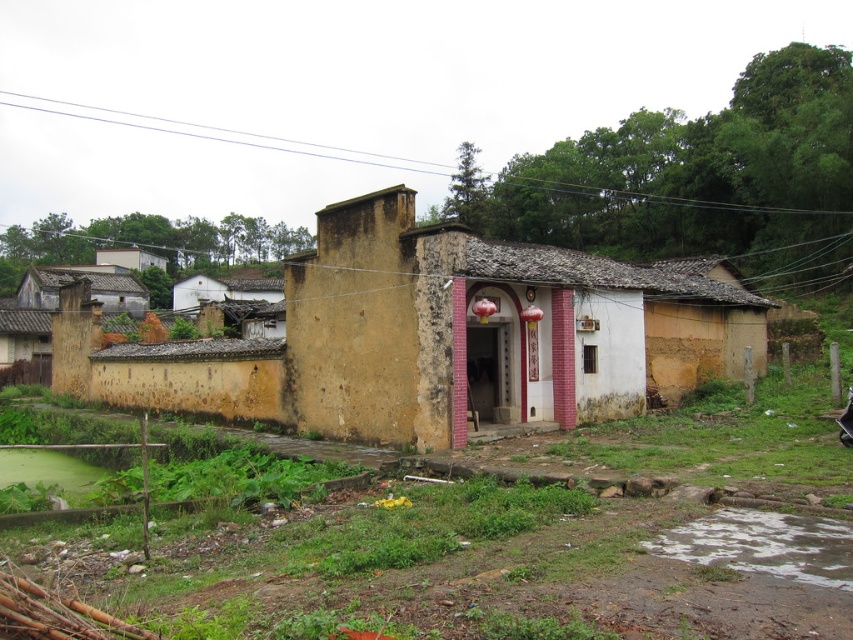
You are a delivery person trying to park your van between the yellow stucco house at center and the rusty metal hut at left. The van is 2 meters wide. Can you fit it there?

The yellow stucco house at center is narrower than the rusty metal hut at left. However, without knowing the exact distance between them, we cannot determine if the 2m van can fit. Please check the actual space between the two structures.

You are standing at the entrance of the old building and want to walk towards the point labeled as point (61, 284). However, there is an obstacle at point (502, 289). Will you encounter this obstacle before reaching your destination?

Yes, you will encounter the obstacle at point (502, 289) before reaching point (61, 284) because point (502, 289) is in front of point (61, 284).

You are standing in a rural area and see the yellow stucco house at center and the rusty metal hut at left. Which structure is closer to you?

The yellow stucco house at center is closer because it is in front of the rusty metal hut at left.